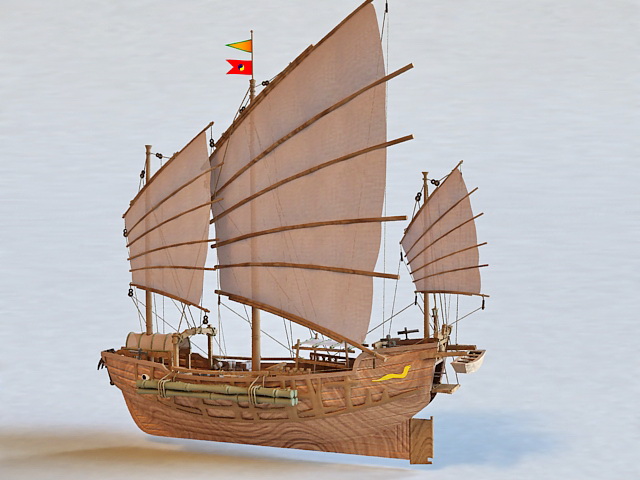
Locate an element on the screen. toy is located at coordinates (413, 405).